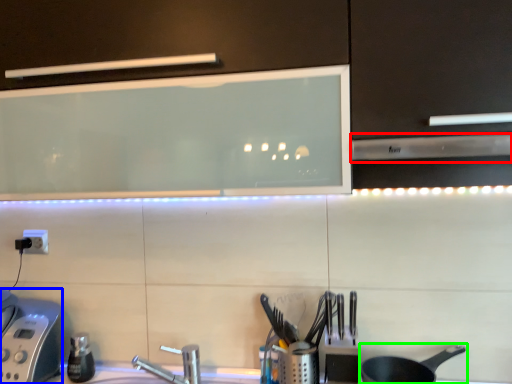
Question: Considering the real-world distances, which object is farthest from exhaust hood (highlighted by a red box)? appliance (highlighted by a blue box) or frying pan (highlighted by a green box)?

Choices:
 (A) appliance
 (B) frying pan

Answer: (A)